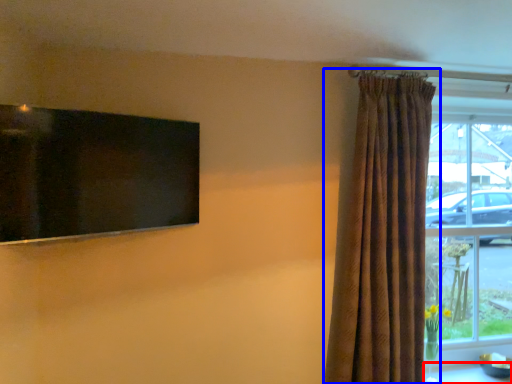
Question: Which point is further to the camera, table (highlighted by a red box) or curtain (highlighted by a blue box)?

Choices:
 (A) table
 (B) curtain

Answer: (A)